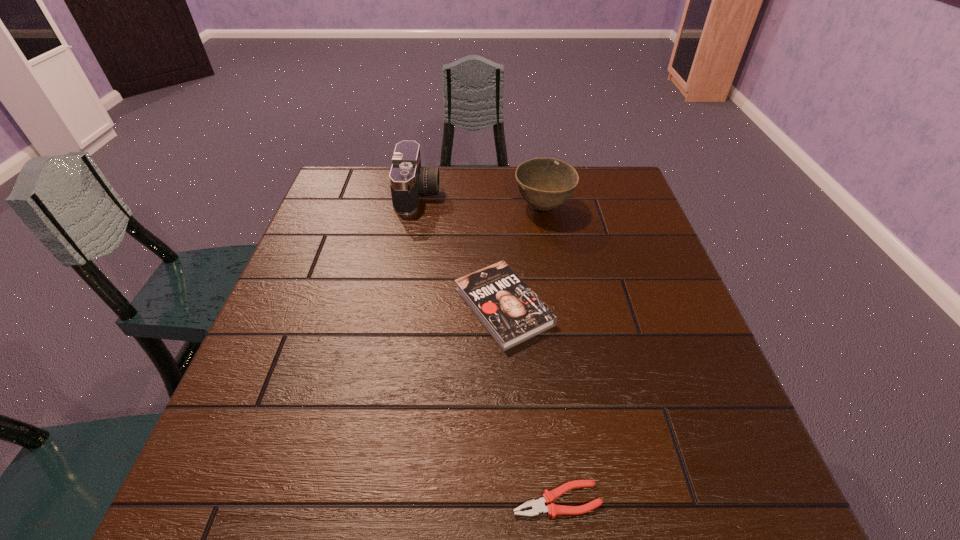
Where is `vacant space that's between the bowl and the book`? The width and height of the screenshot is (960, 540). vacant space that's between the bowl and the book is located at coordinates (523, 257).

This screenshot has width=960, height=540. I want to click on unoccupied area between the leftmost object and the shortest object, so click(x=488, y=347).

Locate an element on the screen. vacant region between the pliers and the bowl is located at coordinates (550, 354).

Where is `vacant space that's between the bowl and the nearest object`? The image size is (960, 540). vacant space that's between the bowl and the nearest object is located at coordinates (550, 354).

The height and width of the screenshot is (540, 960). What are the coordinates of `empty location between the second nearest object and the bowl` in the screenshot? It's located at 523,257.

Identify the location of vacant area that lies between the pliers and the third tallest object. (530, 403).

Find the location of a particular element. The height and width of the screenshot is (540, 960). free space between the bowl and the camera is located at coordinates (481, 201).

Locate an element on the screen. The width and height of the screenshot is (960, 540). blank region between the bowl and the leftmost object is located at coordinates (481, 201).

Locate an element on the screen. The image size is (960, 540). vacant space that's between the pliers and the leftmost object is located at coordinates pos(488,347).

Identify which object is located as the nearest to the bowl. Please provide its 2D coordinates. Your answer should be formatted as a tuple, i.e. [(x, y)], where the tuple contains the x and y coordinates of a point satisfying the conditions above.

[(511, 312)]